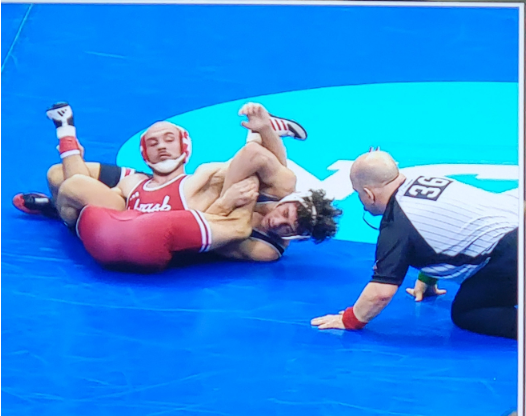
At what (x,y) coordinates should I click in order to perform the action: click on blue mat. Please return your answer as a coordinate pair (x, y). The height and width of the screenshot is (416, 526). Looking at the image, I should click on (138, 351), (268, 37).